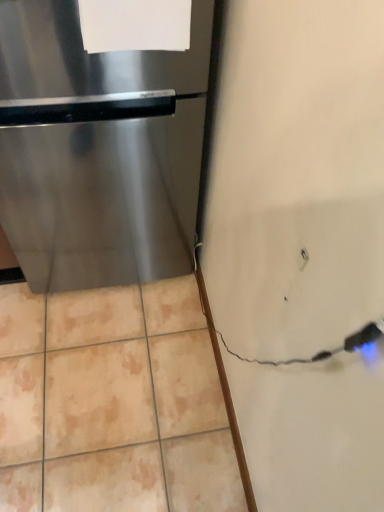
Question: From a real-world perspective, is stainless steel refrigerator at left over white paper at upper center?

Choices:
 (A) no
 (B) yes

Answer: (A)

Question: Does stainless steel refrigerator at left lie in front of white paper at upper center?

Choices:
 (A) yes
 (B) no

Answer: (B)

Question: Considering the relative sizes of stainless steel refrigerator at left and white paper at upper center in the image provided, is stainless steel refrigerator at left wider than white paper at upper center?

Choices:
 (A) yes
 (B) no

Answer: (A)

Question: Is stainless steel refrigerator at left not within white paper at upper center?

Choices:
 (A) yes
 (B) no

Answer: (A)

Question: Could you tell me if stainless steel refrigerator at left is facing white paper at upper center?

Choices:
 (A) yes
 (B) no

Answer: (B)

Question: From the image's perspective, does stainless steel refrigerator at left appear lower than white paper at upper center?

Choices:
 (A) no
 (B) yes

Answer: (B)

Question: Does white paper at upper center have a larger size compared to stainless steel refrigerator at left?

Choices:
 (A) yes
 (B) no

Answer: (B)

Question: Can you confirm if white paper at upper center is taller than stainless steel refrigerator at left?

Choices:
 (A) yes
 (B) no

Answer: (B)

Question: From the image's perspective, is white paper at upper center beneath stainless steel refrigerator at left?

Choices:
 (A) yes
 (B) no

Answer: (B)

Question: Is white paper at upper center in contact with stainless steel refrigerator at left?

Choices:
 (A) yes
 (B) no

Answer: (B)

Question: Could you tell me if white paper at upper center is turned towards stainless steel refrigerator at left?

Choices:
 (A) no
 (B) yes

Answer: (A)

Question: Considering the relative positions of white paper at upper center and stainless steel refrigerator at left in the image provided, is white paper at upper center in front of stainless steel refrigerator at left?

Choices:
 (A) yes
 (B) no

Answer: (A)

Question: Is white paper at upper center bigger or smaller than stainless steel refrigerator at left?

Choices:
 (A) big
 (B) small

Answer: (B)